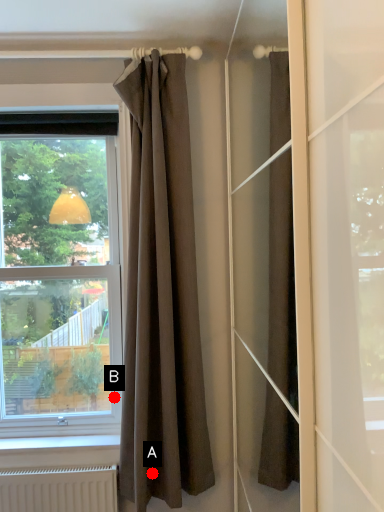
Question: Two points are circled on the image, labeled by A and B beside each circle. Which of the following is the closest to the observer?

Choices:
 (A) A is closer
 (B) B is closer

Answer: (A)